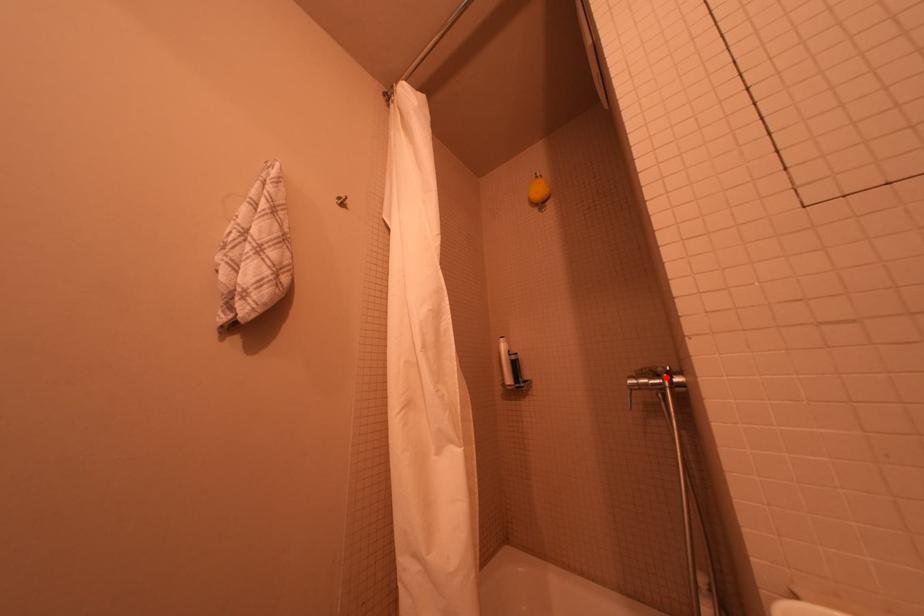
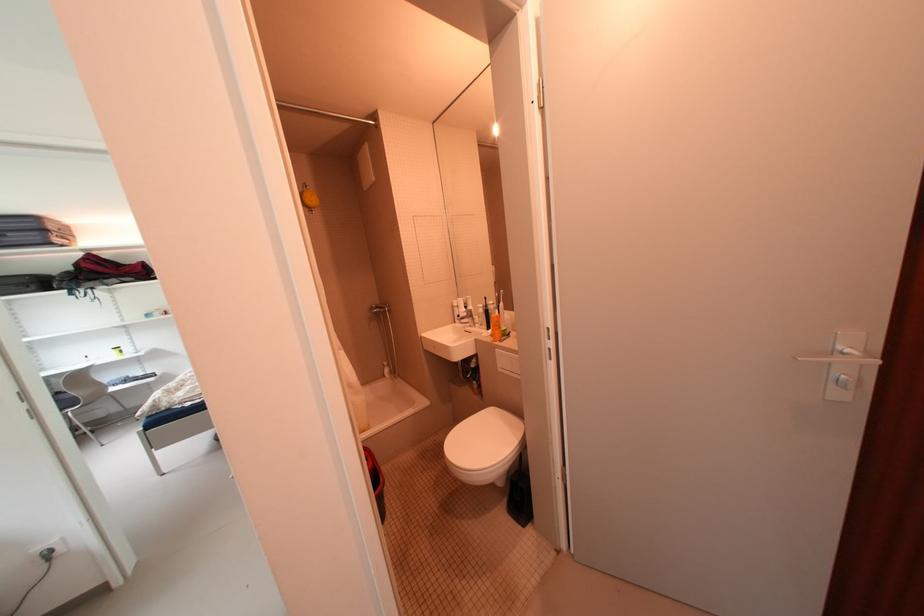
Find the pixel in the second image that matches the highlighted location in the first image.

(390, 309)